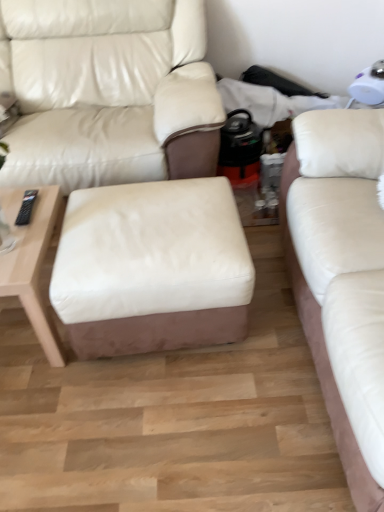
Question: Does light wood/woodentable at left appear on the left side of white leather ottoman at center?

Choices:
 (A) yes
 (B) no

Answer: (A)

Question: Is light wood/woodentable at left with white leather ottoman at center?

Choices:
 (A) yes
 (B) no

Answer: (B)

Question: Does light wood/woodentable at left have a larger size compared to white leather ottoman at center?

Choices:
 (A) no
 (B) yes

Answer: (A)

Question: Is light wood/woodentable at left turned away from white leather ottoman at center?

Choices:
 (A) no
 (B) yes

Answer: (A)

Question: Could you tell me if light wood/woodentable at left is facing white leather ottoman at center?

Choices:
 (A) yes
 (B) no

Answer: (B)

Question: Does light wood/woodentable at left have a smaller size compared to white leather ottoman at center?

Choices:
 (A) yes
 (B) no

Answer: (A)

Question: Is white leather studio couch at right, which is the first studio couch in right-to-left order, not near white leather studio couch at center, arranged as the 1th studio couch when viewed from the left?

Choices:
 (A) yes
 (B) no

Answer: (B)

Question: From the image's perspective, does white leather studio couch at right, which is the first studio couch in right-to-left order, appear lower than white leather studio couch at center, arranged as the 1th studio couch when viewed from the left?

Choices:
 (A) yes
 (B) no

Answer: (A)

Question: Is white leather studio couch at center, acting as the second studio couch starting from the right, at the back of white leather studio couch at right, which is the first studio couch in right-to-left order?

Choices:
 (A) yes
 (B) no

Answer: (B)

Question: Can you confirm if white leather studio couch at right, arranged as the 2th studio couch when viewed from the left, is taller than white leather studio couch at center, acting as the second studio couch starting from the right?

Choices:
 (A) no
 (B) yes

Answer: (A)

Question: Is white leather studio couch at right, arranged as the 2th studio couch when viewed from the left, positioned behind white leather studio couch at center, arranged as the 1th studio couch when viewed from the left?

Choices:
 (A) yes
 (B) no

Answer: (B)

Question: From a real-world perspective, does white leather studio couch at right, arranged as the 2th studio couch when viewed from the left, sit lower than white leather studio couch at center, arranged as the 1th studio couch when viewed from the left?

Choices:
 (A) no
 (B) yes

Answer: (A)

Question: From the image's perspective, does white leather studio couch at center, arranged as the 1th studio couch when viewed from the left, appear lower than white leather ottoman at center?

Choices:
 (A) no
 (B) yes

Answer: (A)